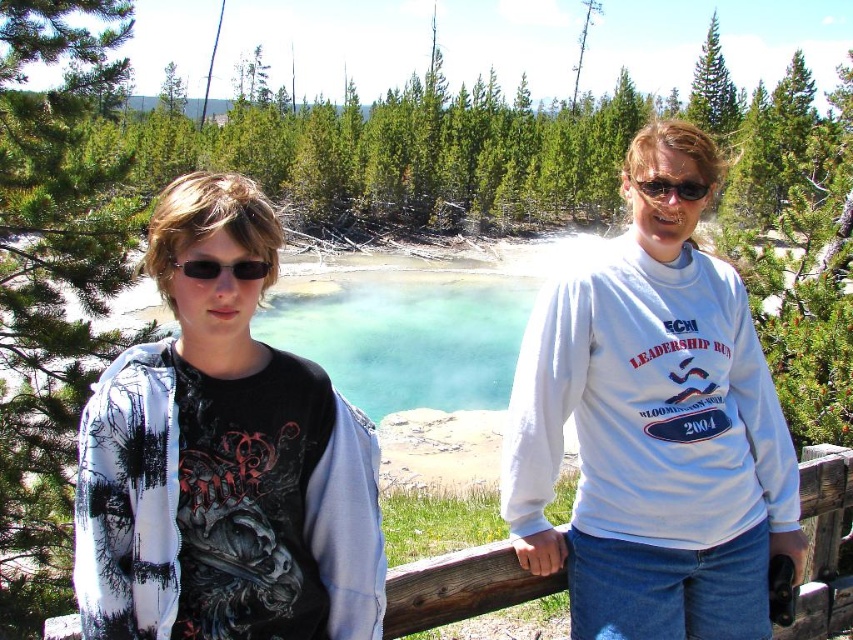
Is white cotton shirt at center shorter than matte black hoodie at left?

No, white cotton shirt at center is not shorter than matte black hoodie at left.

Does point (606, 616) lie behind point (170, 628)?

Yes.

Image resolution: width=853 pixels, height=640 pixels. I want to click on white cotton shirt at center, so click(653, 426).

Which is below, white cotton shirt at center or black plastic sunglasses at upper center?

white cotton shirt at center

Consider the image. Does white cotton shirt at center have a larger size compared to black plastic sunglasses at upper center?

Indeed, white cotton shirt at center has a larger size compared to black plastic sunglasses at upper center.

Which is behind, point (746, 540) or point (637, 189)?

The point (637, 189) is behind.

This screenshot has width=853, height=640. Find the location of `white cotton shirt at center`. white cotton shirt at center is located at coordinates (653, 426).

Does point (268, 264) lie in front of point (672, 180)?

Yes, point (268, 264) is in front of point (672, 180).

At what (x,y) coordinates should I click in order to perform the action: click on black plastic sunglasses at left. Please return your answer as a coordinate pair (x, y). Looking at the image, I should click on (222, 268).